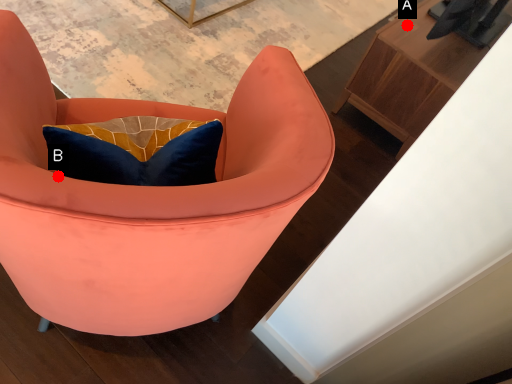
Question: Two points are circled on the image, labeled by A and B beside each circle. Which point is farther to the camera?

Choices:
 (A) A is further
 (B) B is further

Answer: (A)